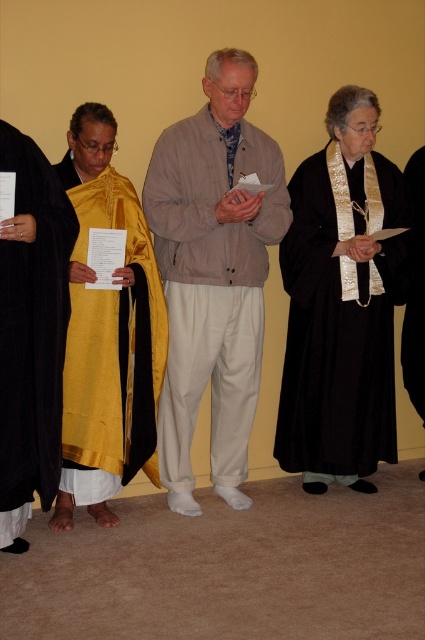
Question: From the image, what is the correct spatial relationship of light brown cotton jacket at center in relation to black silk robe at right?

Choices:
 (A) left
 (B) right

Answer: (A)

Question: Which point is farther from the camera taking this photo?

Choices:
 (A) (289, 468)
 (B) (25, 365)
 (C) (223, 52)

Answer: (A)

Question: Which of the following is the farthest from the observer?

Choices:
 (A) black matte robe at left
 (B) golden silk robe at left

Answer: (B)

Question: Does black velvet robe at right appear on the right side of golden silk robe at left?

Choices:
 (A) no
 (B) yes

Answer: (B)

Question: Among these objects, which one is nearest to the camera?

Choices:
 (A) golden silk robe at left
 (B) black velvet robe at right
 (C) black silk robe at right
 (D) black matte robe at left

Answer: (D)

Question: Can you confirm if light brown cotton jacket at center is smaller than black matte robe at left?

Choices:
 (A) yes
 (B) no

Answer: (B)